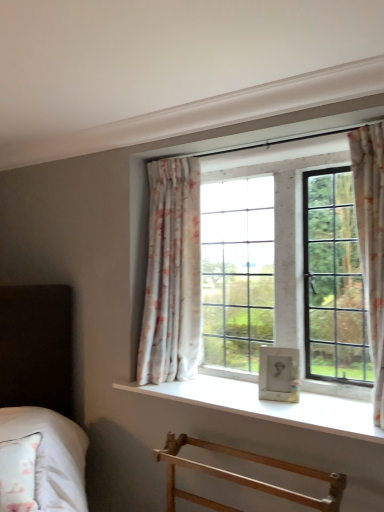
Question: Is floral fabric curtain at right, positioned as the second curtain in left-to-right order, far away from white smooth window sill at center?

Choices:
 (A) no
 (B) yes

Answer: (A)

Question: Is floral fabric curtain at right, the 2th curtain in the back-to-front sequence, in contact with white smooth window sill at center?

Choices:
 (A) yes
 (B) no

Answer: (B)

Question: Is floral fabric curtain at right, the 1th curtain from the front, further to camera compared to white smooth window sill at center?

Choices:
 (A) no
 (B) yes

Answer: (B)

Question: Is floral fabric curtain at right, positioned as the second curtain in left-to-right order, thinner than white smooth window sill at center?

Choices:
 (A) yes
 (B) no

Answer: (A)

Question: From a real-world perspective, is floral fabric curtain at right, positioned as the second curtain in left-to-right order, located higher than white smooth window sill at center?

Choices:
 (A) no
 (B) yes

Answer: (B)

Question: Is floral fabric curtain at right, the 1th curtain from the front, positioned before white smooth window sill at center?

Choices:
 (A) yes
 (B) no

Answer: (B)

Question: Can you confirm if light wood towel rack at lower center is bigger than white smooth window sill at center?

Choices:
 (A) no
 (B) yes

Answer: (B)

Question: Is light wood towel rack at lower center positioned beyond the bounds of white smooth window sill at center?

Choices:
 (A) no
 (B) yes

Answer: (B)

Question: Is light wood towel rack at lower center next to white smooth window sill at center?

Choices:
 (A) no
 (B) yes

Answer: (A)

Question: From a real-world perspective, is light wood towel rack at lower center positioned over white smooth window sill at center based on gravity?

Choices:
 (A) no
 (B) yes

Answer: (A)

Question: Does light wood towel rack at lower center have a greater width compared to white smooth window sill at center?

Choices:
 (A) no
 (B) yes

Answer: (A)

Question: Is light wood towel rack at lower center at the left side of white smooth window sill at center?

Choices:
 (A) no
 (B) yes

Answer: (B)

Question: Are light wood towel rack at lower center and floral fabric curtain at right, positioned as the second curtain in left-to-right order, beside each other?

Choices:
 (A) yes
 (B) no

Answer: (B)